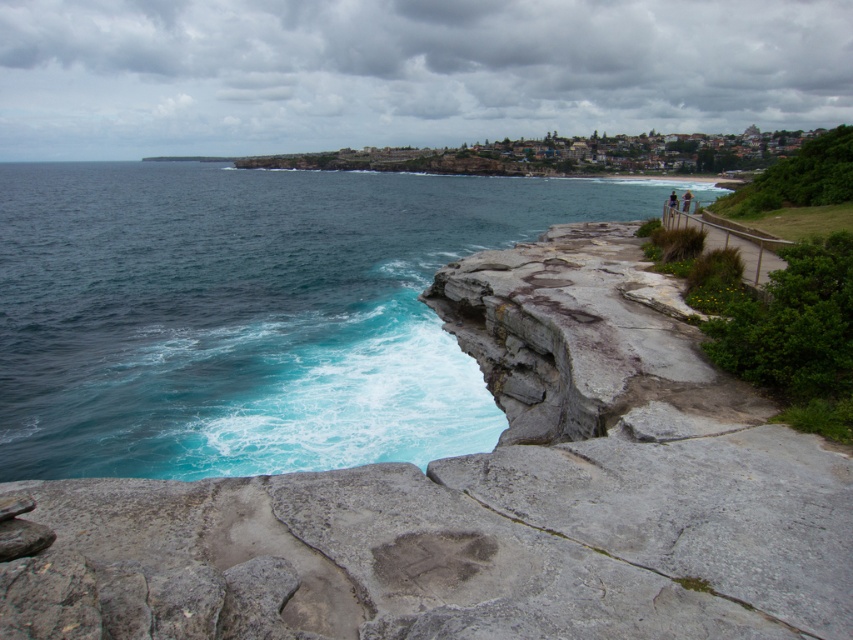
Question: Is blue water at center bigger than dark blue fabric at upper right?

Choices:
 (A) yes
 (B) no

Answer: (A)

Question: Among these objects, which one is nearest to the camera?

Choices:
 (A) blue water at center
 (B) light brown wooden post at upper right

Answer: (A)

Question: Which point appears farthest from the camera in this image?

Choices:
 (A) (117, 499)
 (B) (367, 429)
 (C) (675, 195)

Answer: (C)

Question: In this image, where is gray rock at center located relative to dark blue fabric at upper right?

Choices:
 (A) above
 (B) below

Answer: (B)

Question: Which is farther from the dark blue fabric at upper right?

Choices:
 (A) gray rock at center
 (B) blue water at center
 (C) light brown wooden post at upper right

Answer: (B)

Question: Does gray rock at center appear on the left side of light brown wooden post at upper right?

Choices:
 (A) no
 (B) yes

Answer: (B)